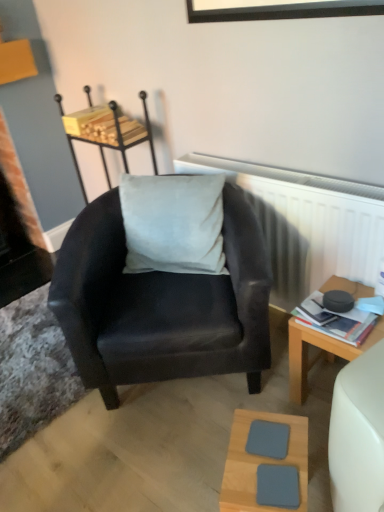
Find the location of a particular element. free point above hardcover book at right (from a real-world perspective) is located at coordinates (336, 316).